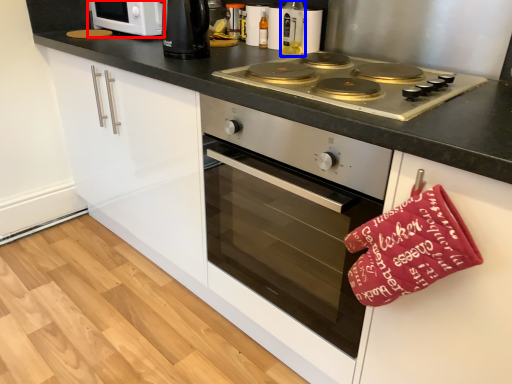
Question: Which object is closer to the camera taking this photo, home appliance (highlighted by a red box) or bottle (highlighted by a blue box)?

Choices:
 (A) home appliance
 (B) bottle

Answer: (B)